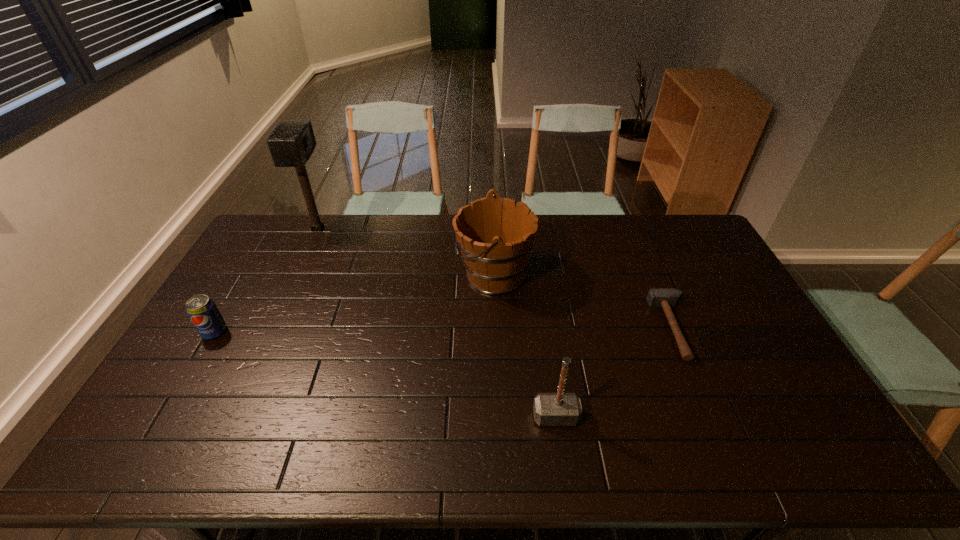
What are the coordinates of `object present at the left edge` in the screenshot? It's located at (202, 310).

Locate an element on the screen. The image size is (960, 540). vacant space at the far edge is located at coordinates (428, 215).

Identify the location of vacant space at the near edge of the desktop. Image resolution: width=960 pixels, height=540 pixels. (390, 432).

The height and width of the screenshot is (540, 960). In order to click on vacant area at the left edge of the desktop in this screenshot , I will do coord(268,280).

Locate an element on the screen. free location at the far left corner is located at coordinates (270, 219).

Find the location of a particular element. empty space between the soda and the taller hammer is located at coordinates (385, 374).

Where is `free point between the fourth object from right to left and the taller hammer`? The image size is (960, 540). free point between the fourth object from right to left and the taller hammer is located at coordinates (437, 323).

You are a GUI agent. You are given a task and a screenshot of the screen. Output one action in this format:
    pyautogui.click(x=<x>, y=<y>)
    Task: Click on the unoccupied area between the tallest object and the second shortest object
    
    Given the screenshot: What is the action you would take?
    pyautogui.click(x=266, y=280)

Find the location of a particular element. vacant space that's between the farthest object and the wine bucket is located at coordinates (406, 252).

This screenshot has height=540, width=960. I want to click on free space that is in between the soda and the tallest object, so click(266, 280).